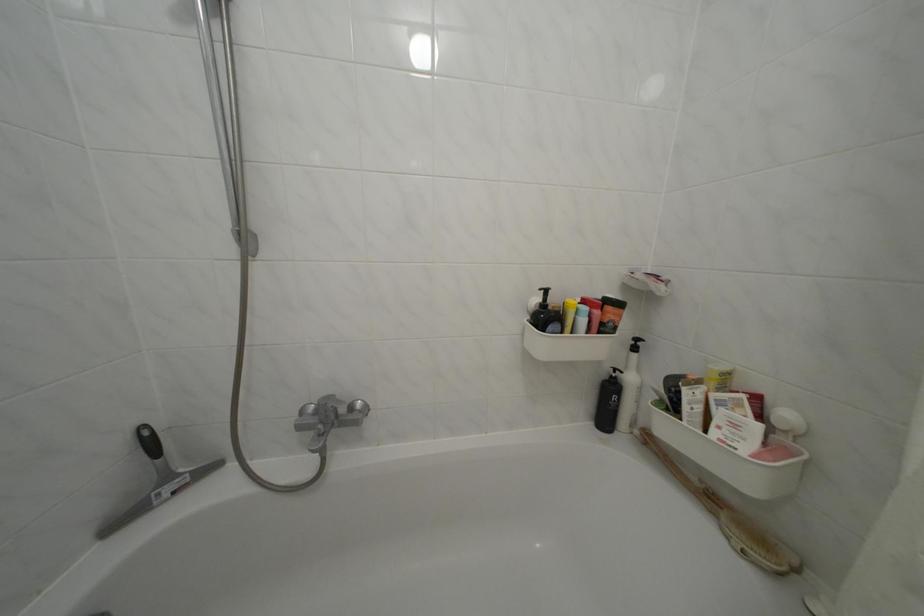
Find where to squeez the white cosmetic bottle. Please return your answer as a coordinate pair (x, y).

(629, 389)